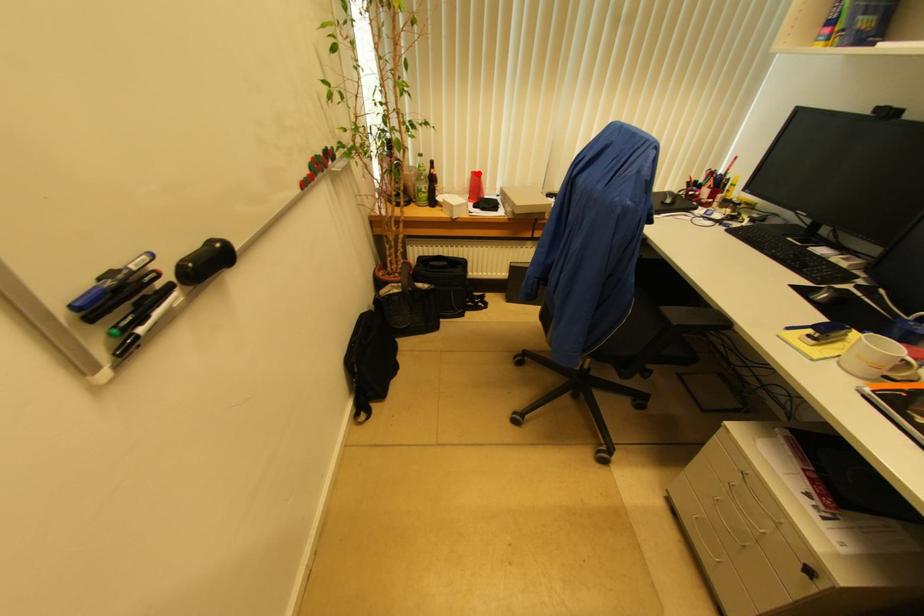
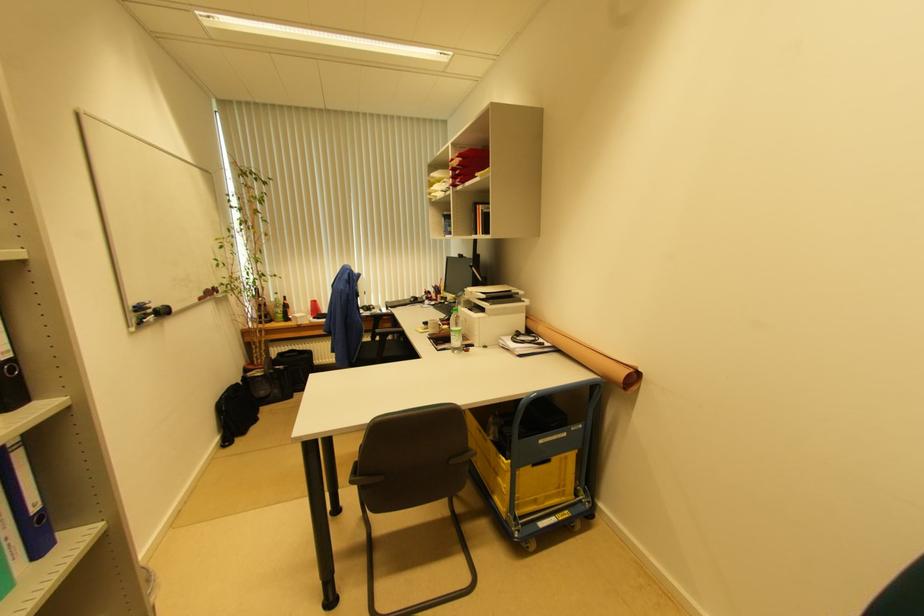
Question: I am providing you with two images of the same scene from different viewpoints. Given a red point in image1, look at the same physical point in image2. Is it:

Choices:
 (A) Closer to the viewpoint
 (B) Farther from the viewpoint

Answer: (B)